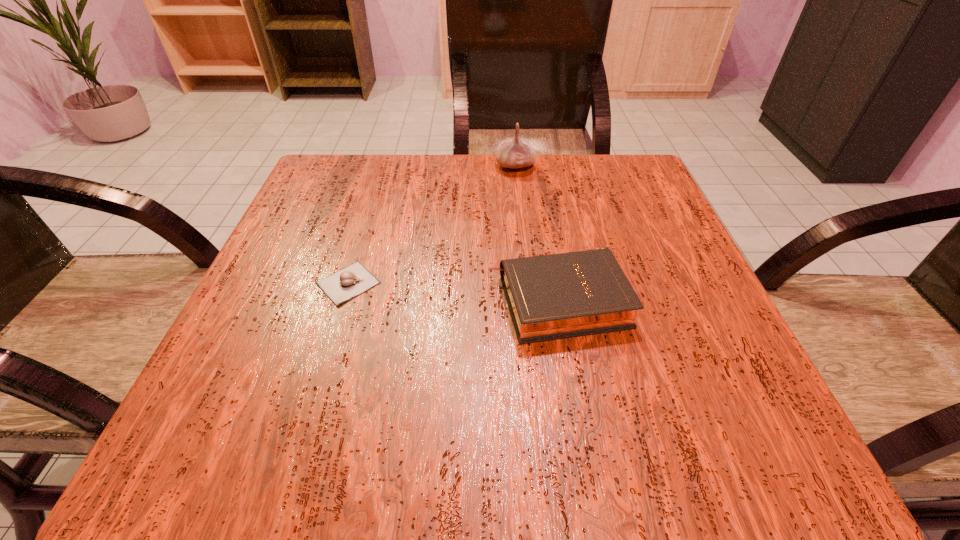
Locate an element on the screen. the farthest object is located at coordinates (516, 153).

Locate an element on the screen. The width and height of the screenshot is (960, 540). the right garlic is located at coordinates (516, 153).

In order to click on Bible in this screenshot , I will do `click(555, 296)`.

Identify the location of the nearer garlic. (349, 282).

This screenshot has height=540, width=960. In order to click on the left garlic in this screenshot , I will do `click(349, 282)`.

The width and height of the screenshot is (960, 540). Identify the location of free space located on the left of the farther garlic. (345, 166).

Where is `free spot located 0.360m on the back of the second tallest object`? This screenshot has height=540, width=960. free spot located 0.360m on the back of the second tallest object is located at coordinates (534, 163).

Locate an element on the screen. blank area located 0.180m on the back of the shortest object is located at coordinates (372, 204).

Identify the location of object that is at the far edge. Image resolution: width=960 pixels, height=540 pixels. (516, 153).

I want to click on object positioned at the left edge, so click(349, 282).